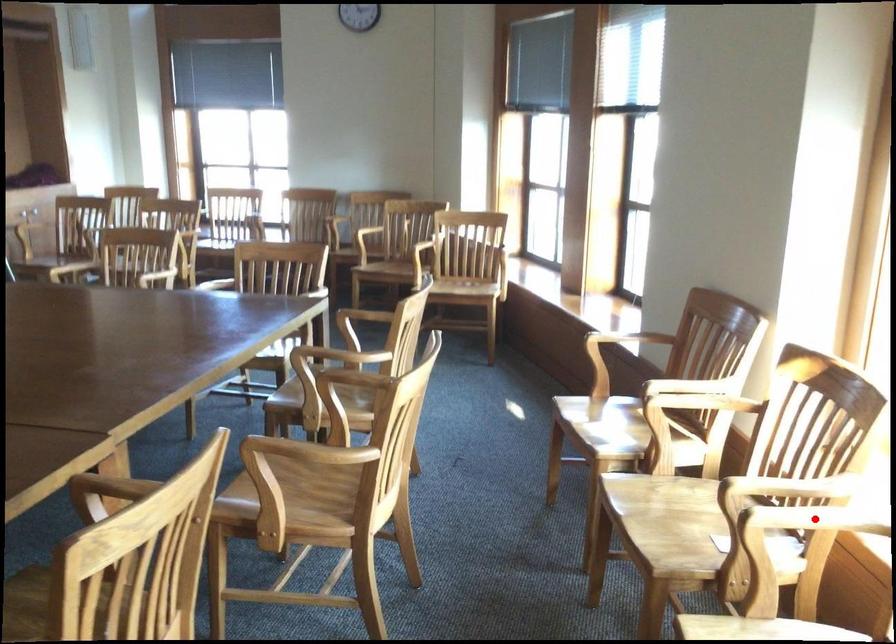
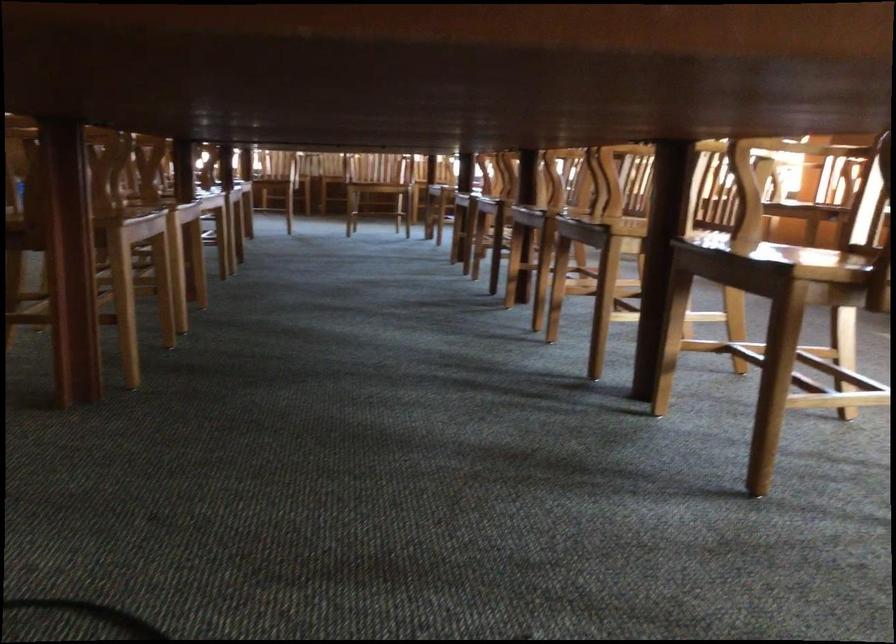
Question: I am providing you with two images of the same scene from different viewpoints. A red point is marked on the first image. Can you still see the location of the red point in image 2?

Choices:
 (A) Yes
 (B) No

Answer: (B)